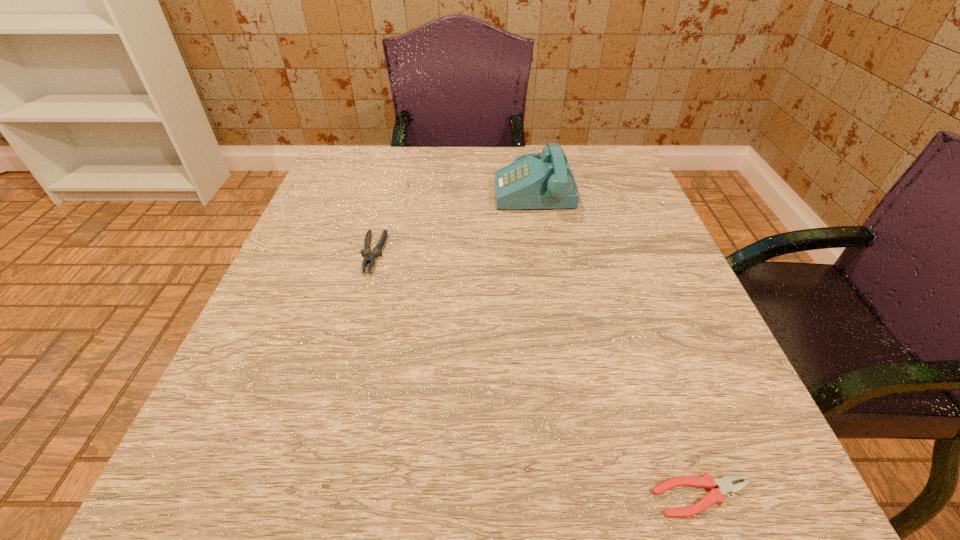
Where is `vacant space at the left edge of the desktop`? This screenshot has width=960, height=540. vacant space at the left edge of the desktop is located at coordinates (302, 302).

At what (x,y) coordinates should I click in order to perform the action: click on free space at the right edge of the desktop. Please return your answer as a coordinate pair (x, y). This screenshot has height=540, width=960. Looking at the image, I should click on (688, 318).

In the image, there is a desktop. At what (x,y) coordinates should I click in order to perform the action: click on vacant space at the far left corner. Please return your answer as a coordinate pair (x, y). Looking at the image, I should click on (377, 197).

At what (x,y) coordinates should I click in order to perform the action: click on vacant space at the near left corner of the desktop. Please return your answer as a coordinate pair (x, y). This screenshot has height=540, width=960. Looking at the image, I should click on (200, 511).

Identify the location of free point at the far right corner. The image size is (960, 540). (581, 169).

Where is `vacant area that lies between the tallest object and the shorter pliers`? Image resolution: width=960 pixels, height=540 pixels. vacant area that lies between the tallest object and the shorter pliers is located at coordinates (618, 341).

At what (x,y) coordinates should I click in order to perform the action: click on unoccupied area between the shortest object and the farthest object. Please return your answer as a coordinate pair (x, y). This screenshot has width=960, height=540. Looking at the image, I should click on (618, 341).

Where is `empty location between the taller pliers and the telephone`? empty location between the taller pliers and the telephone is located at coordinates (453, 219).

Identify the location of free space between the tallest object and the right pliers. This screenshot has height=540, width=960. (618, 341).

You are a GUI agent. You are given a task and a screenshot of the screen. Output one action in this format:
    pyautogui.click(x=<x>, y=<y>)
    Task: Click on the free space between the shorter pliers and the telephone
    This screenshot has height=540, width=960.
    Given the screenshot: What is the action you would take?
    pyautogui.click(x=618, y=341)